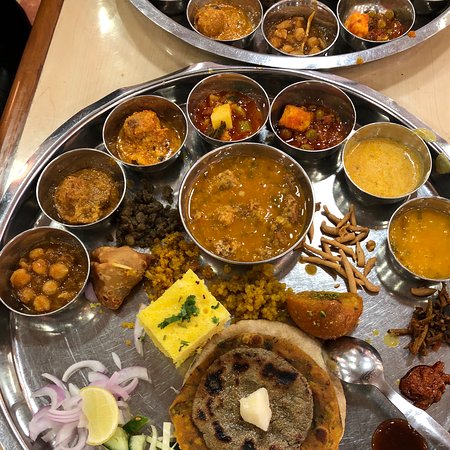
You are a GUI agent. You are given a task and a screenshot of the screen. Output one action in this format:
    pyautogui.click(x=<x>, y=<y>)
    Task: Click on the edge of food tray
    Image resolution: width=450 pixels, height=450 pixels.
    Given the screenshot: What is the action you would take?
    pyautogui.click(x=21, y=173), pyautogui.click(x=204, y=44)